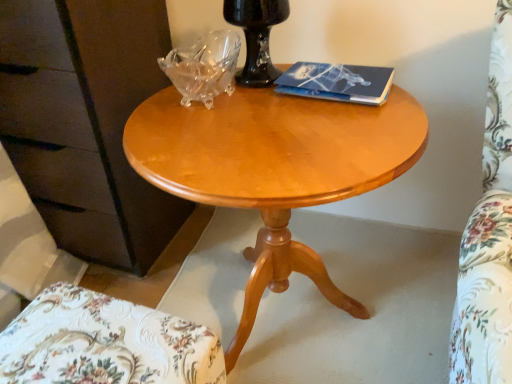
Identify the location of free space to the left of blue matte paper at upper right. The height and width of the screenshot is (384, 512). point(251,104).